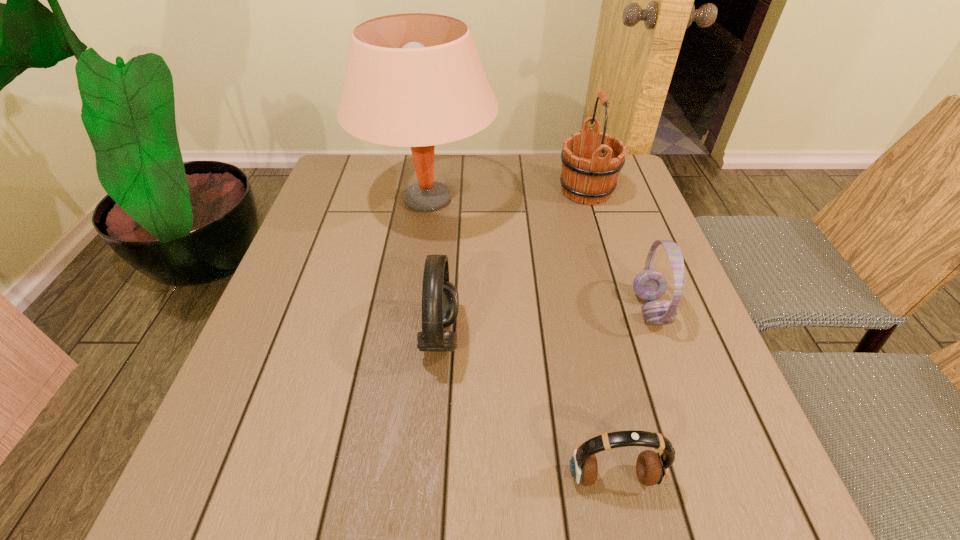
The width and height of the screenshot is (960, 540). I want to click on free spot at the far edge of the desktop, so click(508, 173).

Find the location of a particular element. Image resolution: width=960 pixels, height=540 pixels. free space at the near edge of the desktop is located at coordinates (627, 478).

This screenshot has width=960, height=540. Identify the location of vacant space at the left edge of the desktop. pos(324,269).

In the image, there is a desktop. Find the location of `free region at the right edge`. free region at the right edge is located at coordinates (732, 417).

The image size is (960, 540). Identify the location of free point at the far left corner. (321, 197).

This screenshot has width=960, height=540. What are the coordinates of `blank space at the near left corner of the desktop` in the screenshot? It's located at (237, 497).

Where is `vacant space in between the shortest headset and the leftmost headset`? The image size is (960, 540). vacant space in between the shortest headset and the leftmost headset is located at coordinates 527,406.

At what (x,y) coordinates should I click in order to perform the action: click on blank region between the tallest object and the rightmost headset. Please return your answer as a coordinate pair (x, y). This screenshot has height=540, width=960. Looking at the image, I should click on pos(539,254).

Identify the location of blank region between the shortest object and the lampshade. (520, 338).

The height and width of the screenshot is (540, 960). I want to click on vacant space in between the leftmost headset and the second tallest object, so click(x=514, y=263).